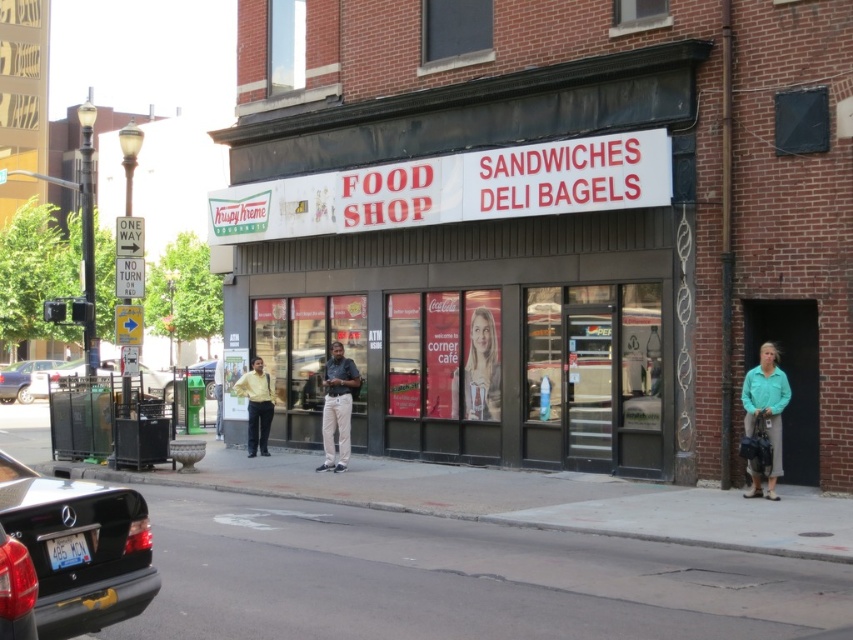
Question: Is yellow matte shirt at center to the left of metallic silver sedan at lower left from the viewer's perspective?

Choices:
 (A) yes
 (B) no

Answer: (B)

Question: Does yellow matte shirt at center appear over metallic silver car at center?

Choices:
 (A) no
 (B) yes

Answer: (B)

Question: Which of the following is the closest to the observer?

Choices:
 (A) (36, 381)
 (B) (773, 467)
 (C) (480, 349)

Answer: (B)

Question: Which point is closer to the camera taking this photo?

Choices:
 (A) (752, 472)
 (B) (146, 365)
 (C) (682, 145)

Answer: (A)

Question: In this image, where is light beige pants at center located relative to yellow matte shirt at center?

Choices:
 (A) below
 (B) above

Answer: (B)

Question: Which object is farther from the camera taking this photo?

Choices:
 (A) silver metallic car at left
 (B) black matte sedan at lower left

Answer: (A)